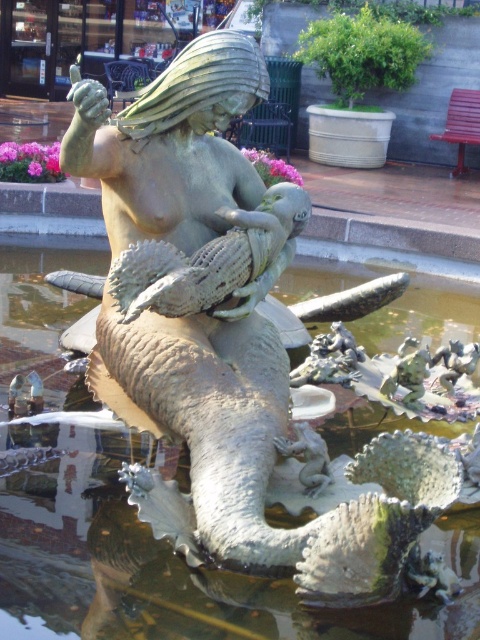
Question: Can you confirm if greenish stone water at center is thinner than matte bronze fish at center?

Choices:
 (A) yes
 (B) no

Answer: (B)

Question: Is greenish stone water at center positioned in front of matte bronze fish at center?

Choices:
 (A) no
 (B) yes

Answer: (A)

Question: Considering the relative positions of greenish stone water at center and matte bronze fish at center in the image provided, where is greenish stone water at center located with respect to matte bronze fish at center?

Choices:
 (A) below
 (B) above

Answer: (B)

Question: Which point is closer to the camera?

Choices:
 (A) (192, 259)
 (B) (20, 300)

Answer: (A)